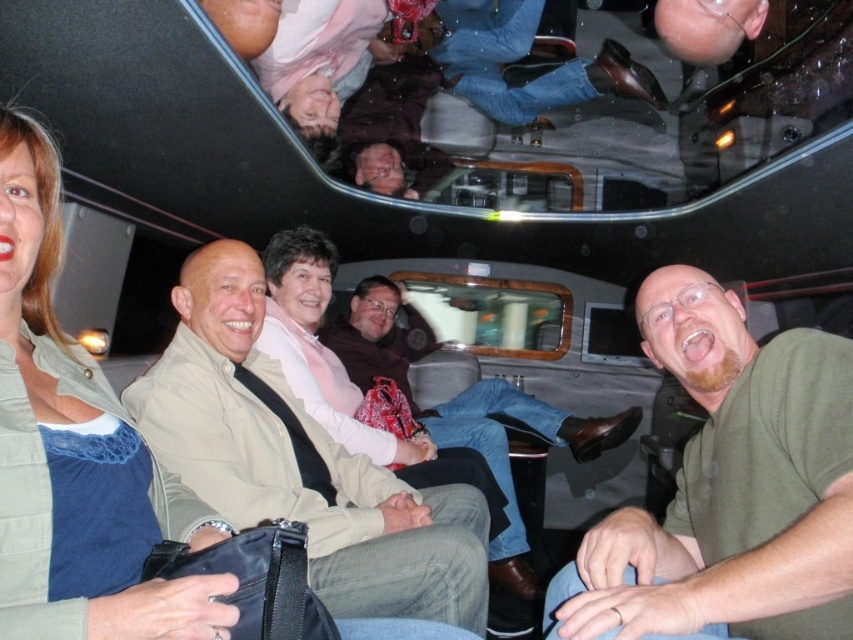
Question: Does denim shirt at left appear on the left side of beige fabric shirt at center?

Choices:
 (A) yes
 (B) no

Answer: (A)

Question: Among these points, which one is nearest to the camera?

Choices:
 (A) (509, 484)
 (B) (45, 330)

Answer: (B)

Question: Can you confirm if denim shirt at left is positioned above beige fabric shirt at center?

Choices:
 (A) no
 (B) yes

Answer: (B)

Question: Does denim shirt at left appear under brown leather jacket at center?

Choices:
 (A) no
 (B) yes

Answer: (A)

Question: Among these points, which one is farthest from the camera?

Choices:
 (A) (785, 580)
 (B) (299, 406)

Answer: (B)

Question: Which of the following is the farthest from the observer?

Choices:
 (A) beige fabric shirt at center
 (B) green matte shirt at center
 (C) denim shirt at left

Answer: (A)